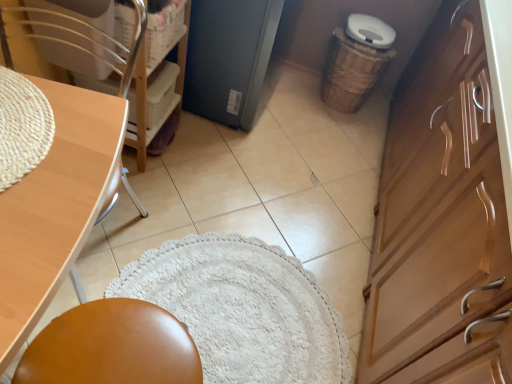
Question: Is matte black refrigerator at center turned away from wooden cabinet at right?

Choices:
 (A) yes
 (B) no

Answer: (B)

Question: Is matte black refrigerator at center aimed at wooden cabinet at right?

Choices:
 (A) yes
 (B) no

Answer: (A)

Question: Considering the relative positions of matte black refrigerator at center and wooden cabinet at right in the image provided, is matte black refrigerator at center in front of wooden cabinet at right?

Choices:
 (A) yes
 (B) no

Answer: (B)

Question: Is matte black refrigerator at center to the left of wooden cabinet at right from the viewer's perspective?

Choices:
 (A) yes
 (B) no

Answer: (A)

Question: Is matte black refrigerator at center behind wooden cabinet at right?

Choices:
 (A) yes
 (B) no

Answer: (A)

Question: Is matte black refrigerator at center positioned far away from wooden cabinet at right?

Choices:
 (A) no
 (B) yes

Answer: (A)

Question: From the image's perspective, would you say woven brown basket at right, which is counted as the 2th basket, starting from the front, is positioned over wooden chair at left?

Choices:
 (A) yes
 (B) no

Answer: (A)

Question: From a real-world perspective, is woven brown basket at right, the 1th basket when ordered from right to left, on wooden chair at left?

Choices:
 (A) no
 (B) yes

Answer: (A)

Question: Does woven brown basket at right, the 1th basket when ordered from right to left, have a lesser width compared to wooden chair at left?

Choices:
 (A) no
 (B) yes

Answer: (B)

Question: Does woven brown basket at right, arranged as the first basket when viewed from the back, have a smaller size compared to wooden chair at left?

Choices:
 (A) no
 (B) yes

Answer: (B)

Question: Would you say woven brown basket at right, marked as the second basket in a left-to-right arrangement, is outside wooden chair at left?

Choices:
 (A) yes
 (B) no

Answer: (A)

Question: Does woven brown basket at right, marked as the second basket in a left-to-right arrangement, turn towards wooden chair at left?

Choices:
 (A) no
 (B) yes

Answer: (A)

Question: Considering the relative positions of matte black refrigerator at center and light brown wood desk at left in the image provided, is matte black refrigerator at center behind light brown wood desk at left?

Choices:
 (A) yes
 (B) no

Answer: (A)